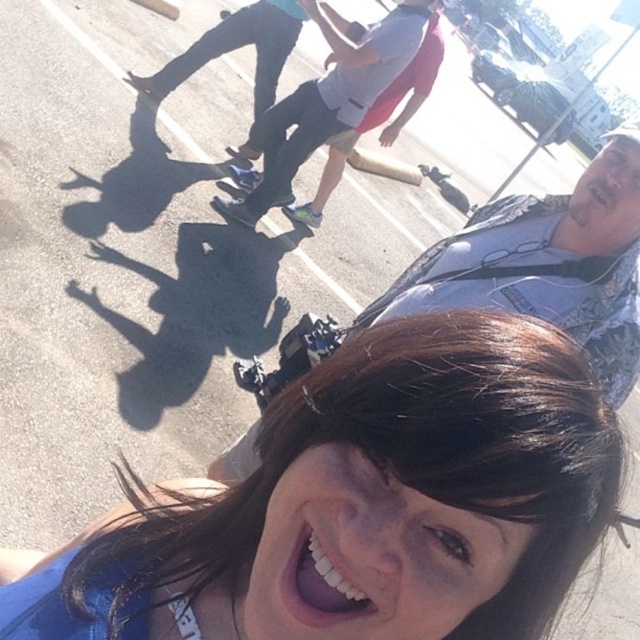
Based on the scene description, can you determine the spatial relationship between the matte black skateboard at center and the white glossy teeth at lower center?

The matte black skateboard at center is to the right of the white glossy teeth at lower center.

You are standing at the point with coordinates point (340, 556) and want to move towards the point with coordinates point (476, 410). Which direction should you move to reach your destination?

You should move forward because point (476, 410) is in front of point (340, 556).

You are a photographer trying to capture a clear shot of both skateboards. The matte black skateboard at center and the white matte skateboard at center are positioned close to each other. Which skateboard should you focus on first if you want to ensure both are in focus without adjusting your camera settings?

The matte black skateboard at center is thinner than the white matte skateboard at center, so focusing on the thicker white matte skateboard at center first would help ensure both are in focus as it occupies more space and might be easier to lock onto with the camera.